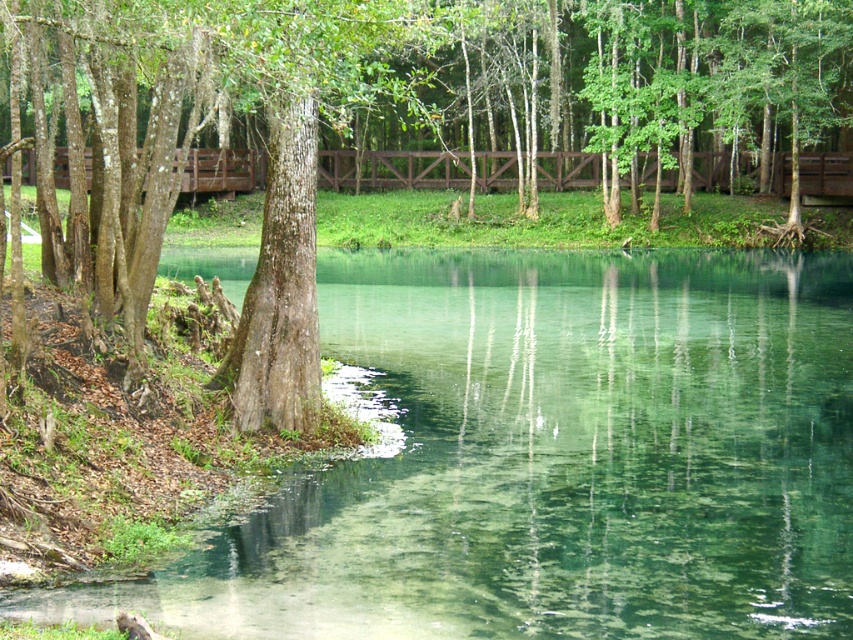
Where is `clear glassy water at center`? clear glassy water at center is located at coordinates (550, 458).

Can you confirm if clear glassy water at center is shorter than smooth bark tree at left?

Indeed, clear glassy water at center has a lesser height compared to smooth bark tree at left.

Which is behind, point (631, 557) or point (277, 310)?

The point (277, 310) is behind.

This screenshot has height=640, width=853. Find the location of `clear glassy water at center`. clear glassy water at center is located at coordinates (550, 458).